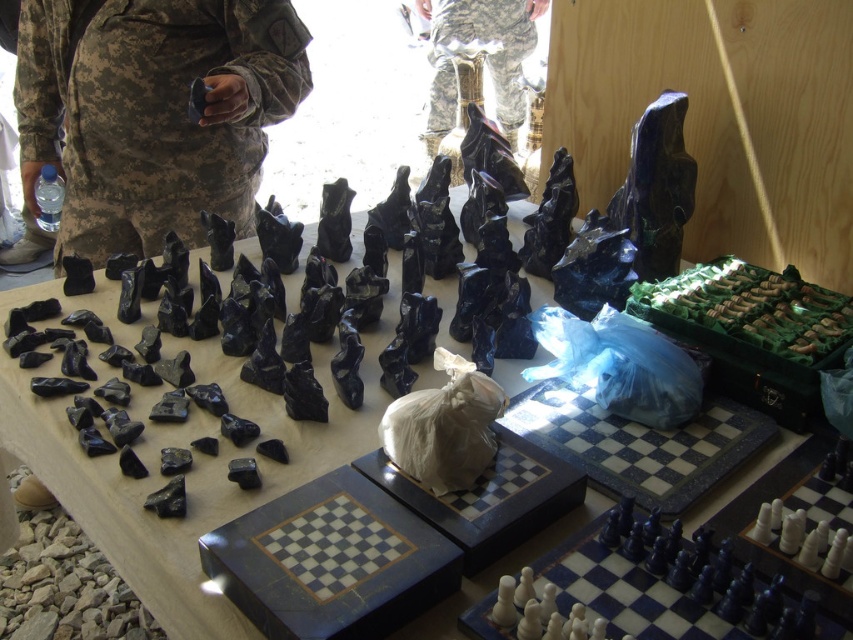
Does black stone chess pieces at center have a larger size compared to camouflage fabric uniform at center?

Correct, black stone chess pieces at center is larger in size than camouflage fabric uniform at center.

Does point (53, 413) come in front of point (236, 205)?

Yes, it is.

You are a GUI agent. You are given a task and a screenshot of the screen. Output one action in this format:
    pyautogui.click(x=<x>, y=<y>)
    Task: Click on the black stone chess pieces at center
    The width and height of the screenshot is (853, 640).
    Given the screenshot: What is the action you would take?
    pyautogui.click(x=178, y=445)

Identify the location of black stone chess pieces at center. The height and width of the screenshot is (640, 853). (178, 445).

Is black stone chess pieces at center wider than camouflage fabric pants at center?

Correct, the width of black stone chess pieces at center exceeds that of camouflage fabric pants at center.

Which is below, black stone chess pieces at center or camouflage fabric pants at center?

black stone chess pieces at center is lower down.

Who is more distant from viewer, (32, 394) or (521, 115)?

The point (521, 115) is behind.

The width and height of the screenshot is (853, 640). I want to click on black stone chess pieces at center, so click(178, 445).

Is camouflage fabric uniform at center positioned in front of camouflage fabric pants at center?

Yes.

Measure the distance between point (28, 10) and camera.

The distance of point (28, 10) from camera is 5.58 feet.

Does point (22, 81) lie behind point (439, 54)?

No, (22, 81) is in front of (439, 54).

This screenshot has width=853, height=640. I want to click on camouflage fabric uniform at center, so click(152, 113).